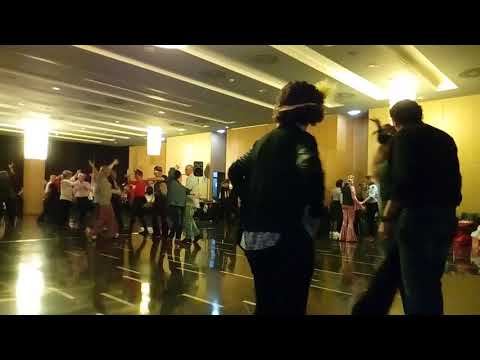
The image size is (480, 360). What are the coordinates of `white dashed lines on floor` in the screenshot? It's located at (66, 291), (116, 296), (135, 282), (134, 268), (195, 297), (247, 301), (192, 269), (231, 272), (113, 254).